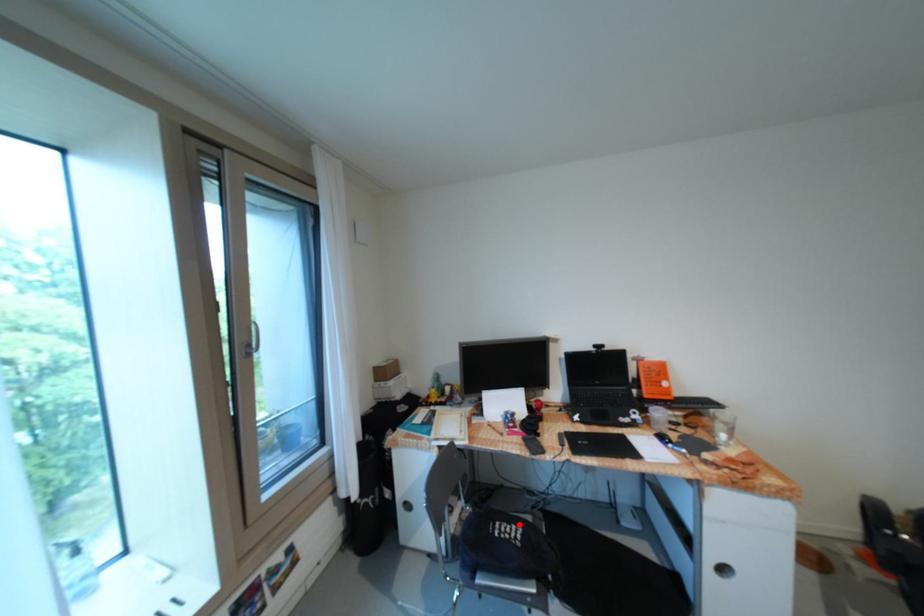
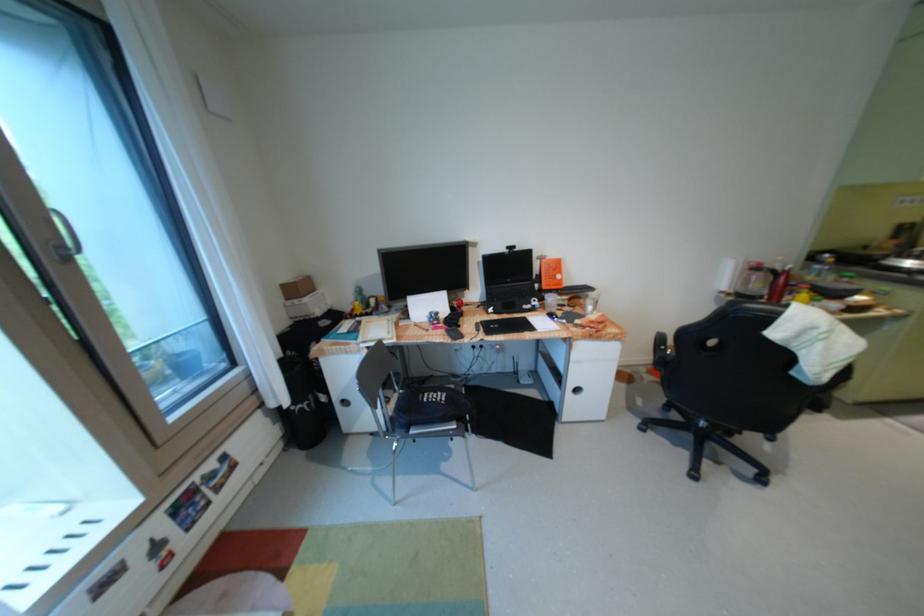
Locate, in the second image, the point that corresponds to the highlighted location in the first image.

(445, 392)